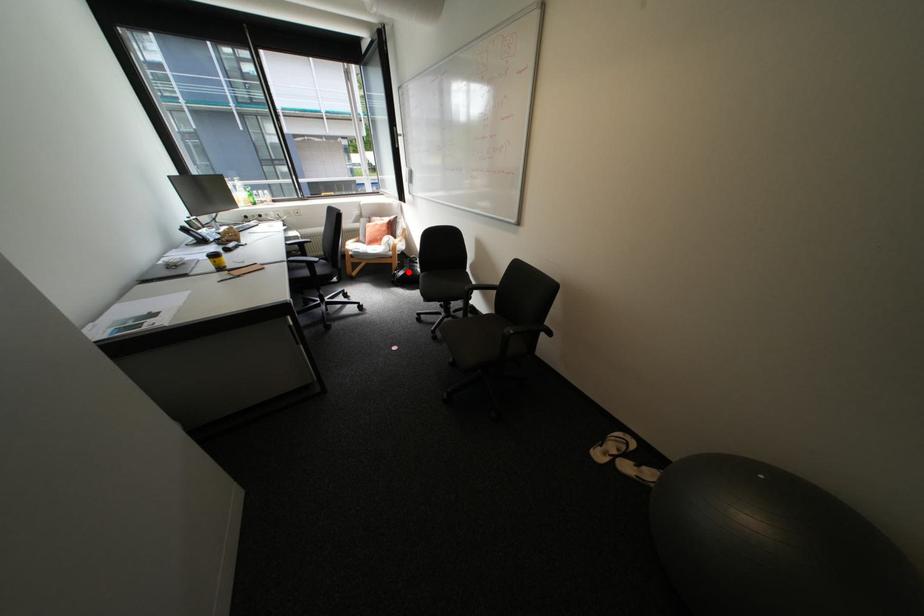
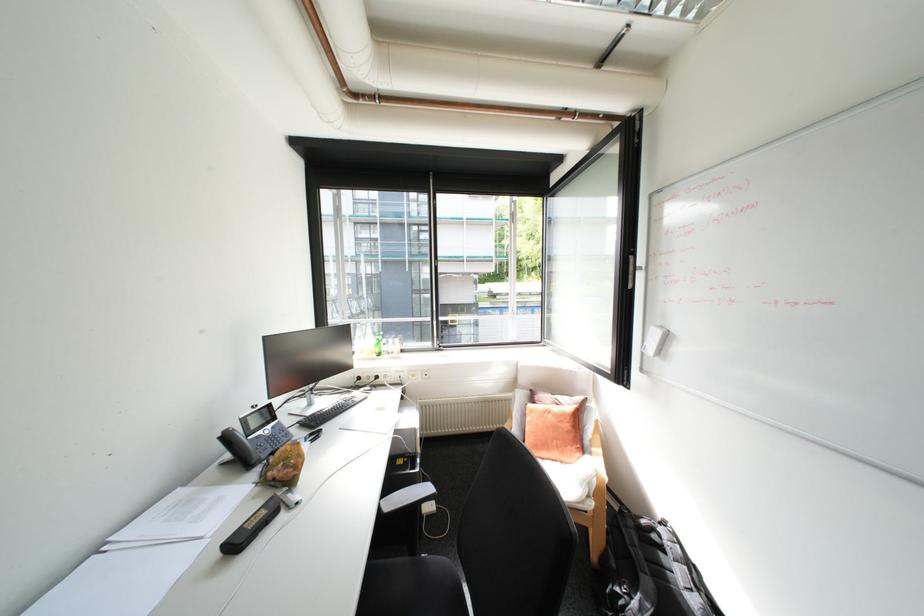
Question: I am providing you with two images of the same scene from different viewpoints. Given a red point in image1, look at the same physical point in image2. Is it:

Choices:
 (A) Closer to the viewpoint
 (B) Farther from the viewpoint

Answer: (A)